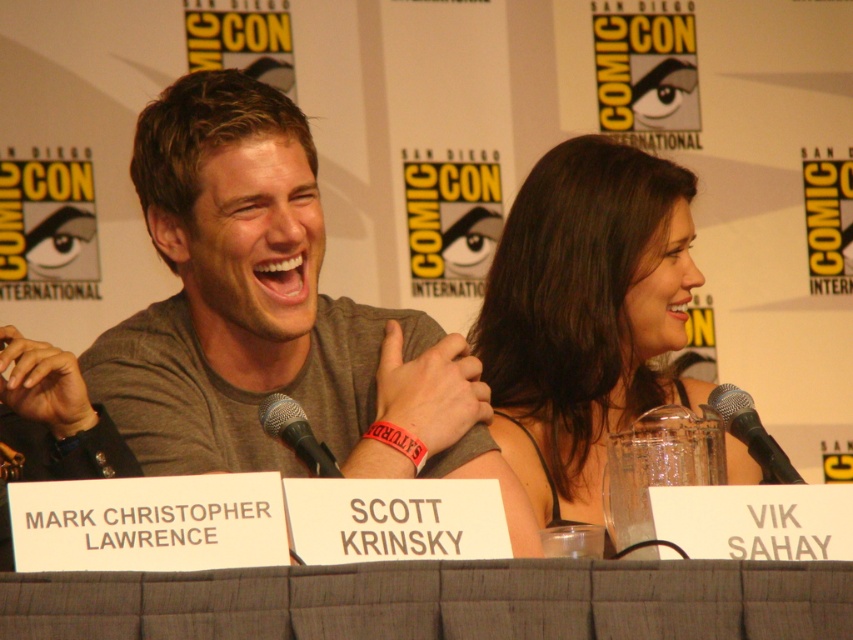
Question: Can you confirm if smooth brown hair at center is positioned above black mesh microphone at center?

Choices:
 (A) no
 (B) yes

Answer: (B)

Question: Is black metallic microphone at center thinner than black mesh microphone at center?

Choices:
 (A) yes
 (B) no

Answer: (A)

Question: Which point appears closest to the camera in this image?

Choices:
 (A) (740, 428)
 (B) (285, 404)

Answer: (B)

Question: Based on their relative distances, which object is nearer to the gray cotton shirt at center?

Choices:
 (A) smooth brown hair at center
 (B) black metallic microphone at center

Answer: (A)

Question: Is gray cotton shirt at center to the left of black mesh microphone at center from the viewer's perspective?

Choices:
 (A) no
 (B) yes

Answer: (B)

Question: Which object is the closest to the black mesh microphone at center?

Choices:
 (A) gray cotton shirt at center
 (B) smooth brown hair at center

Answer: (A)